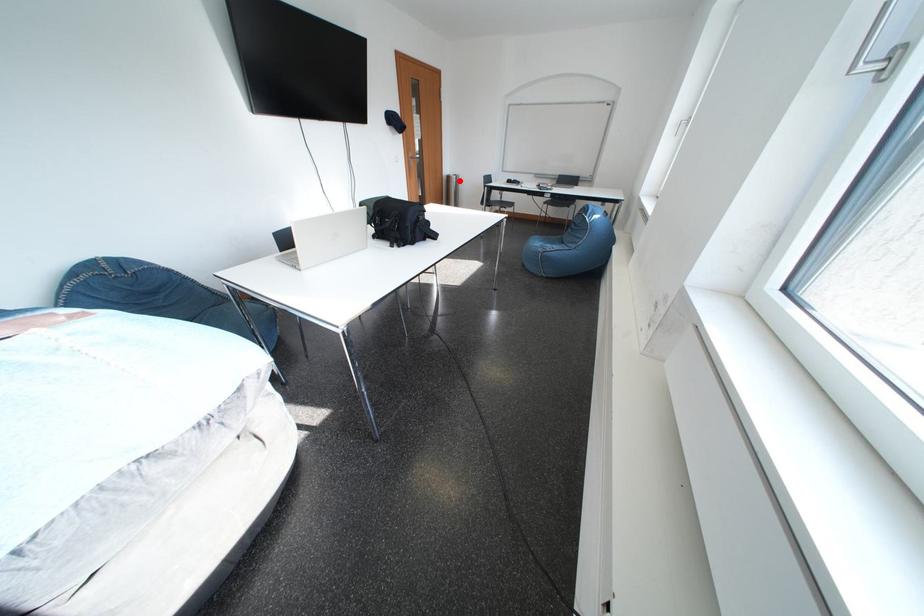
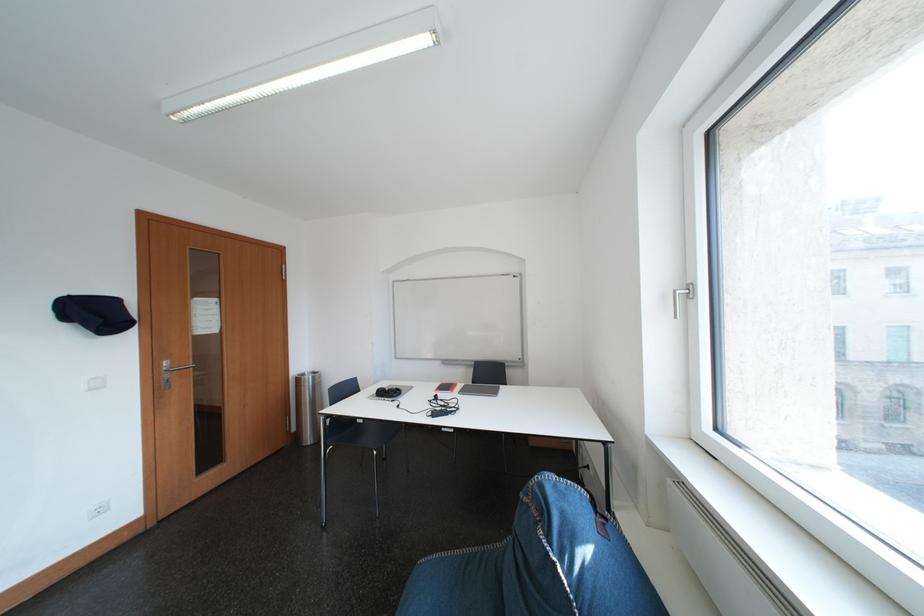
Question: I am providing you with two images of the same scene from different viewpoints. A red point is shown in image1. For the corresponding object point in image2, is it positioned nearer or farther from the camera?

Choices:
 (A) Nearer
 (B) Farther

Answer: (B)